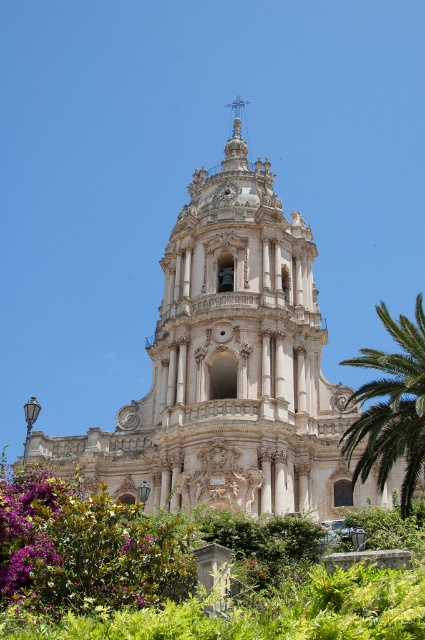
You are standing in front of the white stone church at center and the green leafy palm at right. Which object is taller?

The white stone church at center is taller than the green leafy palm at right.

You are standing in front of the grand, ornate building described in the scene. There is a point at coordinates (231, 368). What object does this point correspond to?

The point at coordinates (231, 368) corresponds to the white stone church at center.